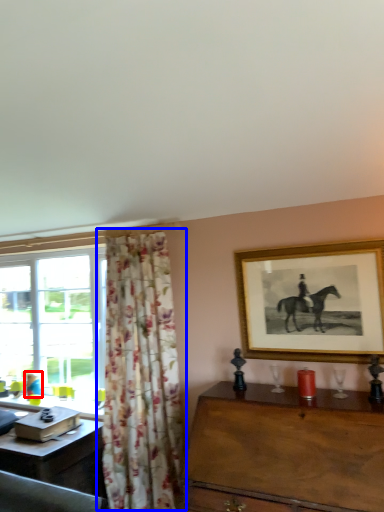
Question: Which point is closer to the camera, person (highlighted by a red box) or curtain (highlighted by a blue box)?

Choices:
 (A) person
 (B) curtain

Answer: (B)